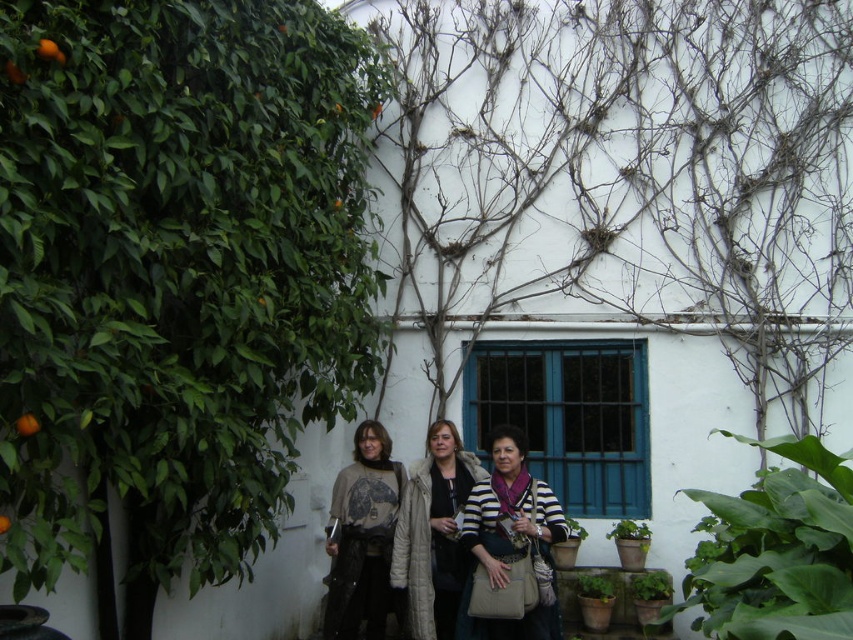
You are a fashion designer observing the scene. You need to decide whether a mannequin standing at the center can display both the white fur coat at center and the orangesmoothfruit at left together. The mannequin is 1.8 meters tall. Can both items be displayed on the mannequin without exceeding its height?

The white fur coat at center is taller than orangesmoothfruit at left. Since the mannequin is 1.8 meters tall, and the white fur coat at center is the taller item, as long as the combined height of both items does not exceed 1.8 meters, they can be displayed together. However, if the white fur coat at center alone exceeds 1.8 meters, then it cannot be displayed. The exact dimensions are not provided, so this depends on their individual heights.

You are organizing a small art exhibition and have two items to display. You have a striped fabric scarf at center and an orange matte at left. The display area has limited space. Which item requires more space due to its size?

The striped fabric scarf at center requires more space because it has a larger size compared to the orange matte at left.

You are standing in the scene and want to move from the orangesmoothfruit at left to the white fur coat at center. Which direction should you move?

You should move to the right to reach the white fur coat at center from the orangesmoothfruit at left because the white fur coat at center is positioned to the right of orangesmoothfruit at left.